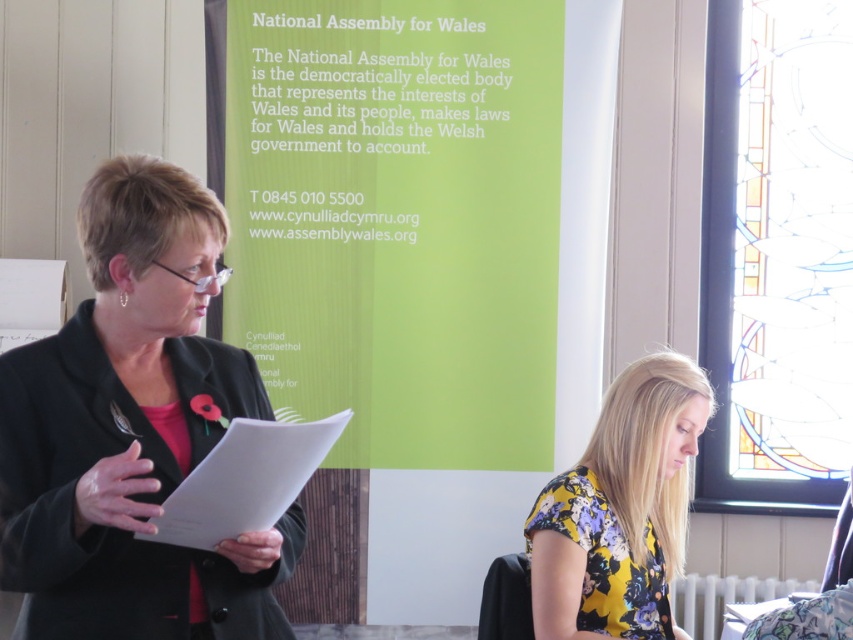
In the scene shown: You are a photographer standing at the back of the room. You want to take a clear photo of the black matte blazer at left without including the National Assembly for Wales banner in the background. Can you adjust your position to achieve this?

The black matte blazer at left is 1.82 meters away from the camera. By moving closer to the subject while angling the camera downward, you can focus on the blazer and avoid capturing the banner in the background.

You are attending a formal event and need to determine if the black matte blazer at left can be folded and placed inside the floral fabric blouse at lower center. Based on their sizes, what is your conclusion?

The black matte blazer at left is much taller than the floral fabric blouse at lower center, so it cannot be folded and placed inside the blouse.

You are an event organizer who needs to arrange seating for a meeting. The black matte blazer at left and the floral fabric blouse at lower center are both present. Which of these two items is positioned more to the left side of the image?

The black matte blazer at left is positioned more to the left side of the image than the floral fabric blouse at lower center.